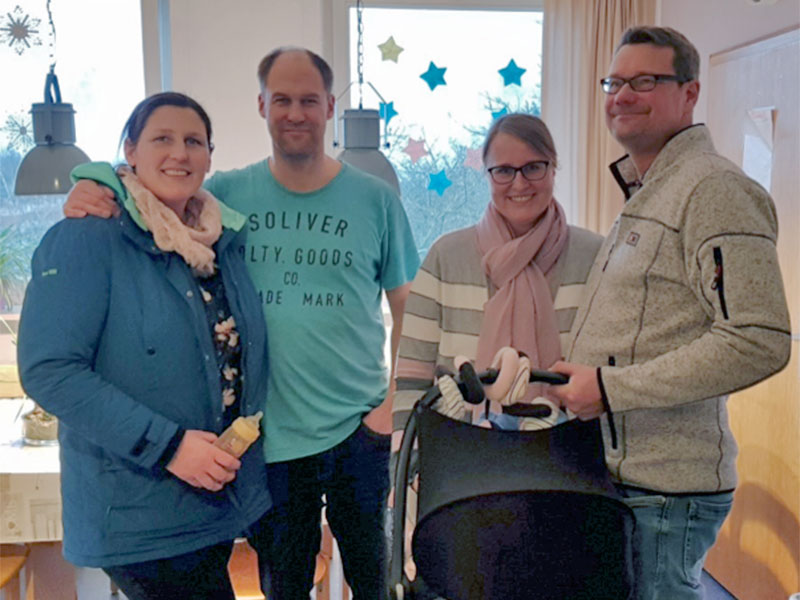
Where is `grey hanging light`? This screenshot has height=600, width=800. grey hanging light is located at coordinates (366, 124), (46, 133).